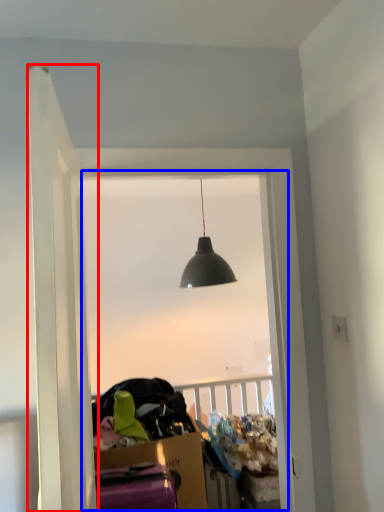
Question: Which point is closer to the camera, door (highlighted by a red box) or window (highlighted by a blue box)?

Choices:
 (A) door
 (B) window

Answer: (A)